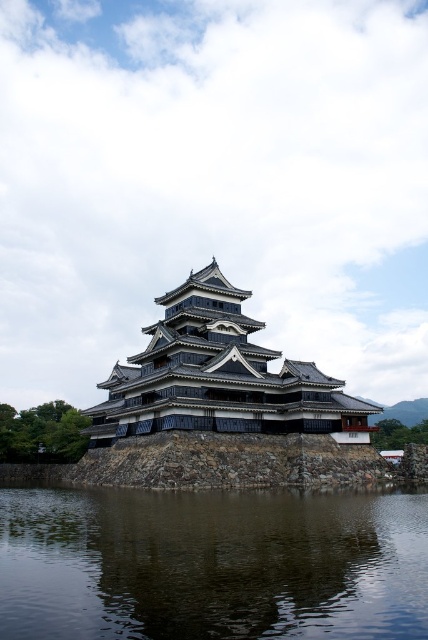
You are standing in front of Matsumoto Castle and want to take a photo of the castle reflected in the dark reflective water at center. Where should you position yourself to ensure the reflection is fully visible?

You should position yourself at point (211, 564) where the dark reflective water at center is located to ensure the reflection is fully visible.

You are a visitor standing in front of Matsumoto Castle. You notice the dark reflective water at center and the black stone fort at center. Which of these two elements takes up more space in the scene?

The black stone fort at center occupies more space than the dark reflective water at center.